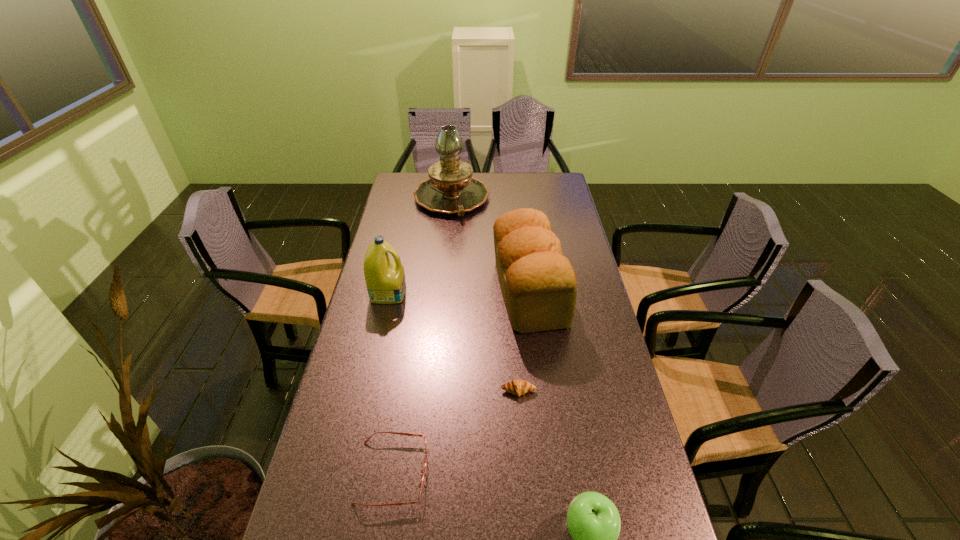
Image resolution: width=960 pixels, height=540 pixels. In order to click on the tallest object in this screenshot , I will do `click(450, 189)`.

I want to click on oil lamp, so (450, 189).

This screenshot has width=960, height=540. I want to click on bread, so tap(539, 286).

At what (x,y) coordinates should I click in order to perform the action: click on detergent. Please return your answer as a coordinate pair (x, y). This screenshot has width=960, height=540. Looking at the image, I should click on point(385,279).

You are a GUI agent. You are given a task and a screenshot of the screen. Output one action in this format:
    pyautogui.click(x=<x>, y=<y>)
    Task: Click on the fifth tallest object
    This screenshot has height=540, width=960.
    Given the screenshot: What is the action you would take?
    pyautogui.click(x=400, y=433)

At what (x,y) coordinates should I click in order to perform the action: click on pastry. Please return your answer as a coordinate pair (x, y). Image resolution: width=960 pixels, height=540 pixels. Looking at the image, I should click on (518, 387).

This screenshot has height=540, width=960. Find the location of `the third nearest object`. the third nearest object is located at coordinates (518, 387).

At what (x,y) coordinates should I click in order to perform the action: click on vacant space located 0.190m on the right of the oil lamp. Please return your answer as a coordinate pair (x, y). Looking at the image, I should click on (532, 199).

Locate an element on the screen. vacant space situated on the left of the bread is located at coordinates (401, 292).

You are a GUI agent. You are given a task and a screenshot of the screen. Output one action in this format:
    pyautogui.click(x=<x>, y=<y>)
    Task: Click on the free space located on the label of the detergent
    This screenshot has width=960, height=540.
    Given the screenshot: What is the action you would take?
    pyautogui.click(x=521, y=292)